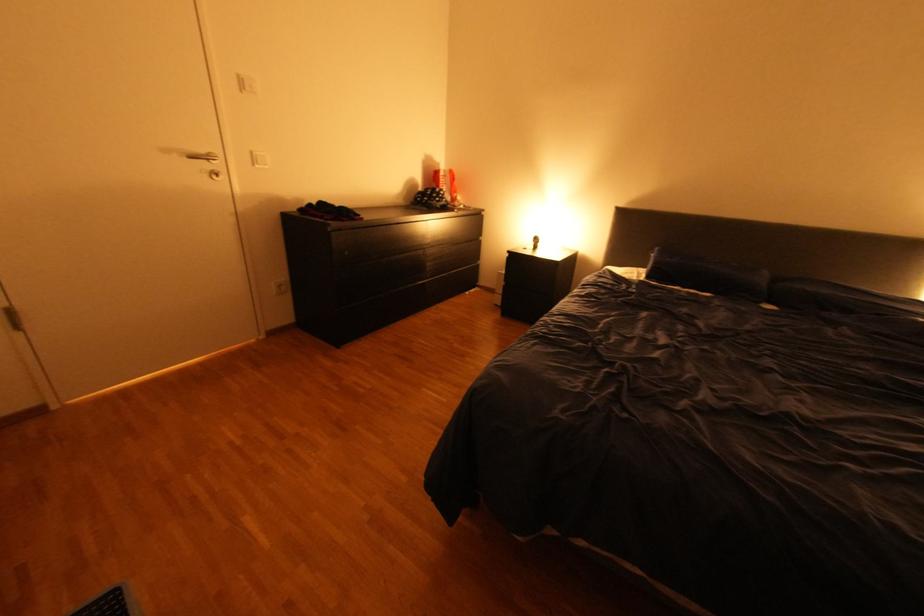
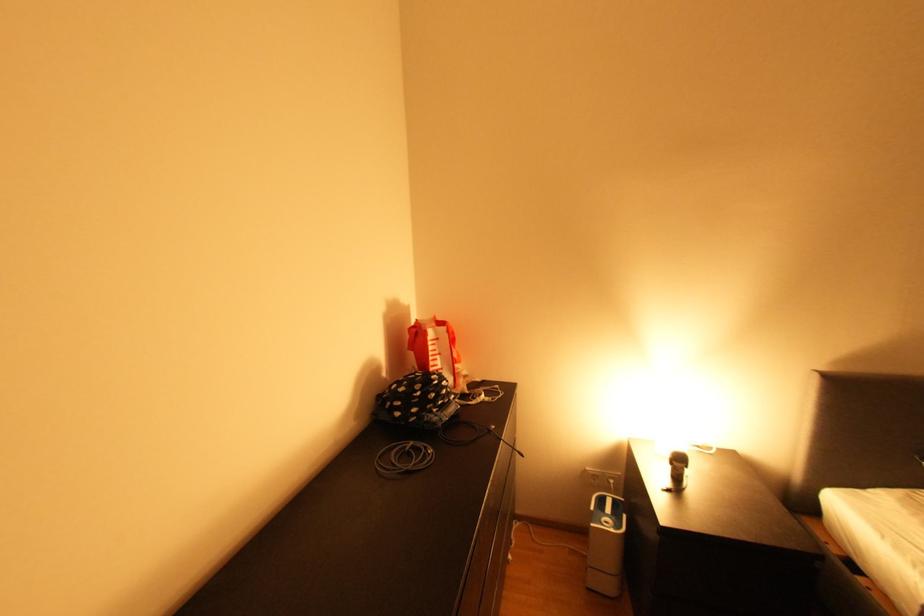
Question: What movement of the cameraman would produce the second image?

Choices:
 (A) Left
 (B) Right
 (C) Forward
 (D) Backward

Answer: (C)